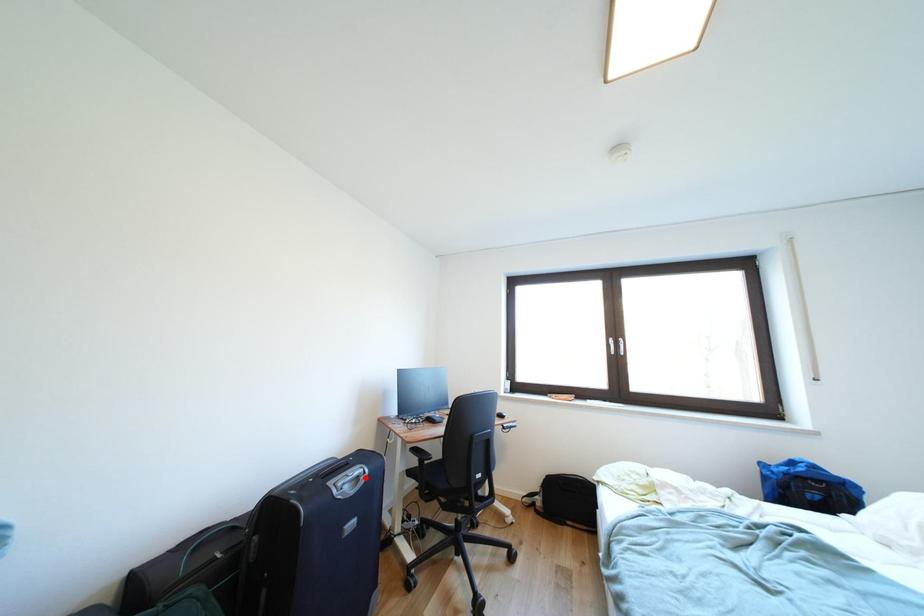
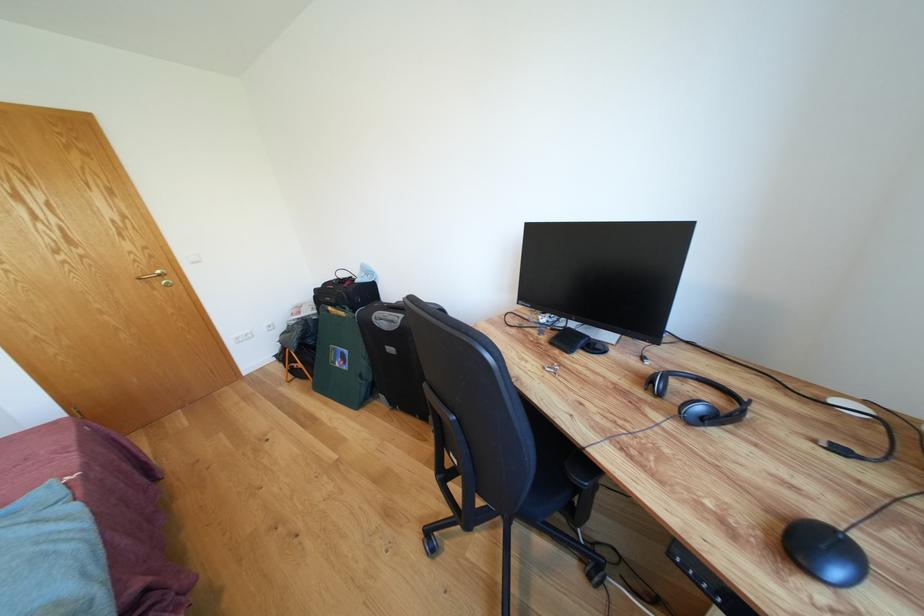
Question: I am providing you with two images of the same scene from different viewpoints. In image1, a red point is highlighted. Considering the same 3D point in image2, which of the following is correct?

Choices:
 (A) It is closer
 (B) It is farther

Answer: (B)